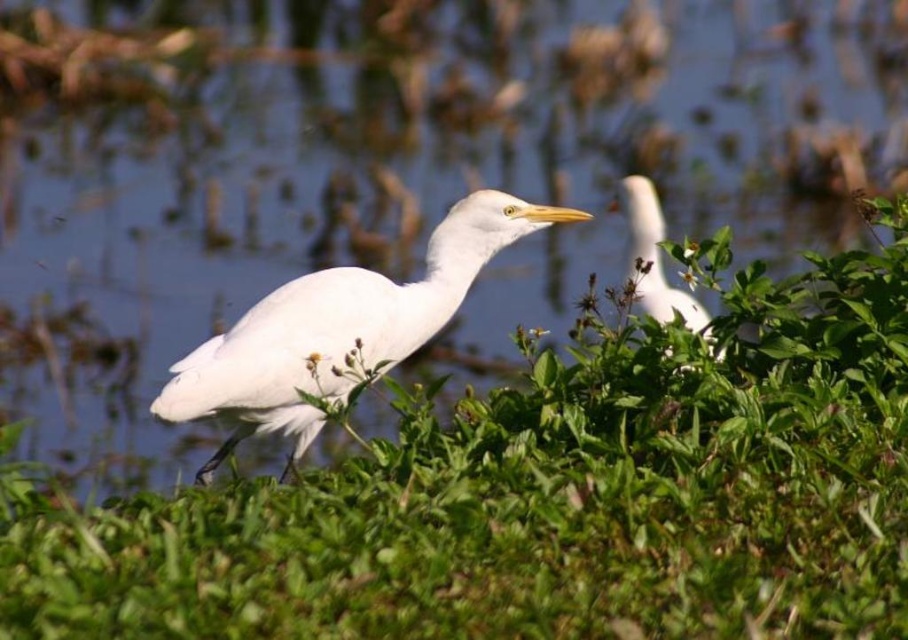
Can you confirm if green leafy plant at center is shorter than white smooth bird at upper right?

No.

Is point (366, 545) closer to viewer compared to point (656, 266)?

Yes.

Who is more distant from viewer, [612,550] or [632,234]?

Point [632,234]

Where is `green leafy plant at center`? The width and height of the screenshot is (908, 640). green leafy plant at center is located at coordinates (548, 497).

Is green leafy plant at center bigger than white matte bird at center?

Yes.

Does green leafy plant at center have a lesser width compared to white matte bird at center?

Incorrect, green leafy plant at center's width is not less than white matte bird at center's.

Find the location of a particular element. green leafy plant at center is located at coordinates (548, 497).

Is point (245, 356) behind point (676, 304)?

No, it is in front of (676, 304).

Can you confirm if white matte bird at center is wider than white smooth bird at upper right?

Yes.

Where is `white matte bird at center`? This screenshot has height=640, width=908. white matte bird at center is located at coordinates (338, 328).